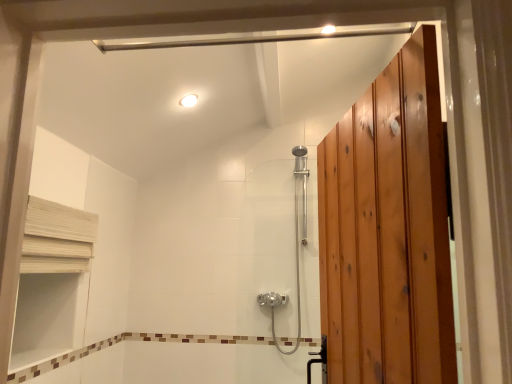
Question: Is white glossy light fixture at upper center aimed at polished chrome shower door at center?

Choices:
 (A) yes
 (B) no

Answer: (B)

Question: Would you say polished chrome shower door at center is part of white glossy light fixture at upper center's contents?

Choices:
 (A) no
 (B) yes

Answer: (A)

Question: From the image's perspective, does white glossy light fixture at upper center appear higher than polished chrome shower door at center?

Choices:
 (A) yes
 (B) no

Answer: (A)

Question: Is white glossy light fixture at upper center to the left of polished chrome shower door at center from the viewer's perspective?

Choices:
 (A) yes
 (B) no

Answer: (A)

Question: From a real-world perspective, does white glossy light fixture at upper center stand above polished chrome shower door at center?

Choices:
 (A) no
 (B) yes

Answer: (B)

Question: Considering the positions of point (48, 251) and point (183, 97), is point (48, 251) closer or farther from the camera than point (183, 97)?

Choices:
 (A) closer
 (B) farther

Answer: (A)

Question: From a real-world perspective, is white wood shelf at upper left above or below white glossy light fixture at upper center?

Choices:
 (A) below
 (B) above

Answer: (A)

Question: From the image's perspective, is white wood shelf at upper left above or below white glossy light fixture at upper center?

Choices:
 (A) below
 (B) above

Answer: (A)

Question: Would you say white wood shelf at upper left is inside or outside white glossy light fixture at upper center?

Choices:
 (A) outside
 (B) inside

Answer: (A)

Question: In terms of size, does polished chrome shower door at center appear bigger or smaller than white glossy light fixture at upper center?

Choices:
 (A) big
 (B) small

Answer: (A)

Question: Is polished chrome shower door at center to the left or to the right of white glossy light fixture at upper center in the image?

Choices:
 (A) right
 (B) left

Answer: (A)

Question: From a real-world perspective, relative to white glossy light fixture at upper center, is polished chrome shower door at center vertically above or below?

Choices:
 (A) above
 (B) below

Answer: (B)

Question: From the image's perspective, is polished chrome shower door at center above or below white glossy light fixture at upper center?

Choices:
 (A) below
 (B) above

Answer: (A)

Question: Is point (184, 96) positioned closer to the camera than point (54, 241)?

Choices:
 (A) farther
 (B) closer

Answer: (A)

Question: Considering their positions, is white glossy light fixture at upper center located in front of or behind white wood shelf at upper left?

Choices:
 (A) front
 (B) behind

Answer: (B)